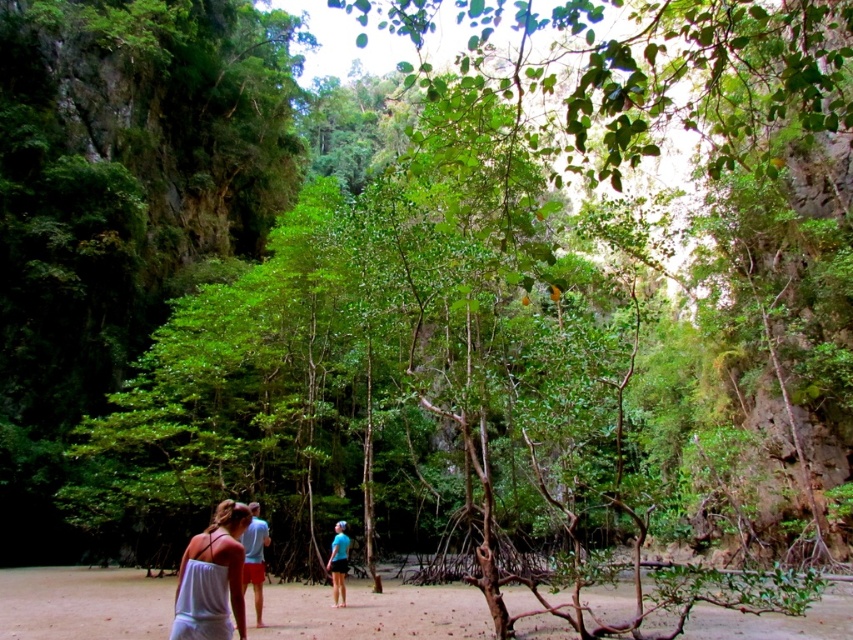
You are a photographer trying to capture a person wearing both the light blue fabric shorts at center and the blue fabric shirt at center. Which clothing item would appear bigger in your photo if you focus on the person from where you are standing?

The light blue fabric shorts at center would appear bigger in the photo since they have a larger size compared to the blue fabric shirt at center.

You are standing in the tropical forest scene and notice the brown sandy dirt at lower center and the white fabric tank top at lower left. Which object is higher in elevation?

The brown sandy dirt at lower center has a greater height compared to the white fabric tank top at lower left, so the brown sandy dirt at lower center is higher in elevation.

You are a photographer trying to capture a candid shot of the blue fabric shirt at center without including the light blue fabric shorts at center in the frame. Based on their positions, is this possible?

The light blue fabric shorts at center is in front of the blue fabric shirt at center, so it would block the view. Therefore, capturing the blue fabric shirt at center without the light blue fabric shorts at center in the frame is not possible.